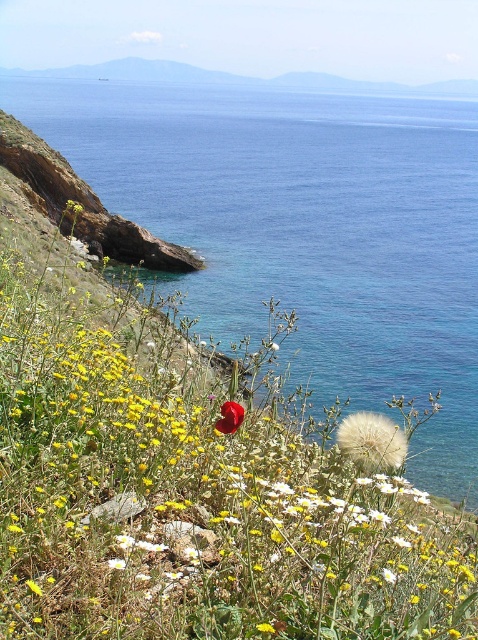
Question: Which point is farther to the camera?

Choices:
 (A) (440, 624)
 (B) (380, 440)

Answer: (B)

Question: Considering the real-world distances, which object is closest to the red matte poppy at center?

Choices:
 (A) bright red petal at center
 (B) blue water at center

Answer: (A)

Question: In this image, where is red matte poppy at center located relative to white fluffy dandelion at center?

Choices:
 (A) above
 (B) below

Answer: (B)

Question: Observing the image, what is the correct spatial positioning of blue water at center in reference to bright red petal at center?

Choices:
 (A) below
 (B) above

Answer: (B)

Question: Is red matte poppy at center wider than blue water at center?

Choices:
 (A) no
 (B) yes

Answer: (A)

Question: Which of the following is the closest to the observer?

Choices:
 (A) (355, 442)
 (B) (58, 616)

Answer: (B)